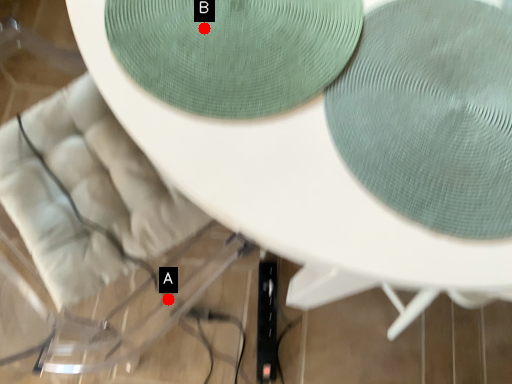
Question: Two points are circled on the image, labeled by A and B beside each circle. Which point is closer to the camera?

Choices:
 (A) A is closer
 (B) B is closer

Answer: (B)